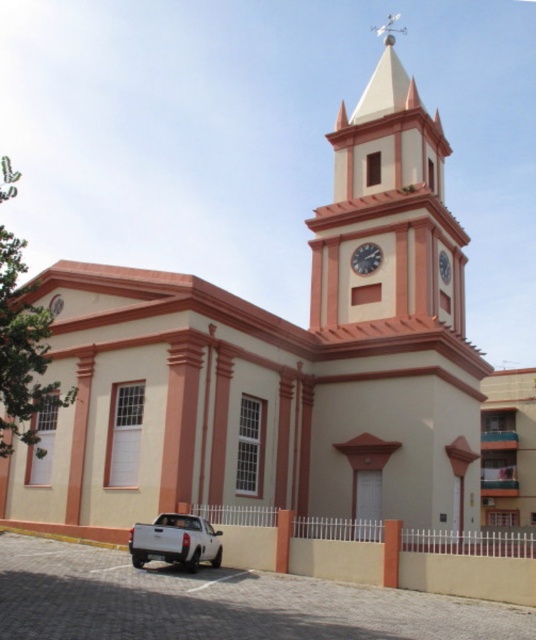
You are standing in front of the church and looking at the structure. Which object is positioned higher up between the matte pink clock tower at upper center and the white glossy clock at upper center?

The matte pink clock tower at upper center is positioned above the white glossy clock at upper center, so it is higher up.

You are standing in front of the church and want to take a photo of the white glossy clock at upper center. The camera you have can focus on objects up to 200 feet away. Will the clock be in focus?

The white glossy clock at upper center is 172.50 feet away from camera, so yes, the camera can focus on it since it is within the 200 feet range.